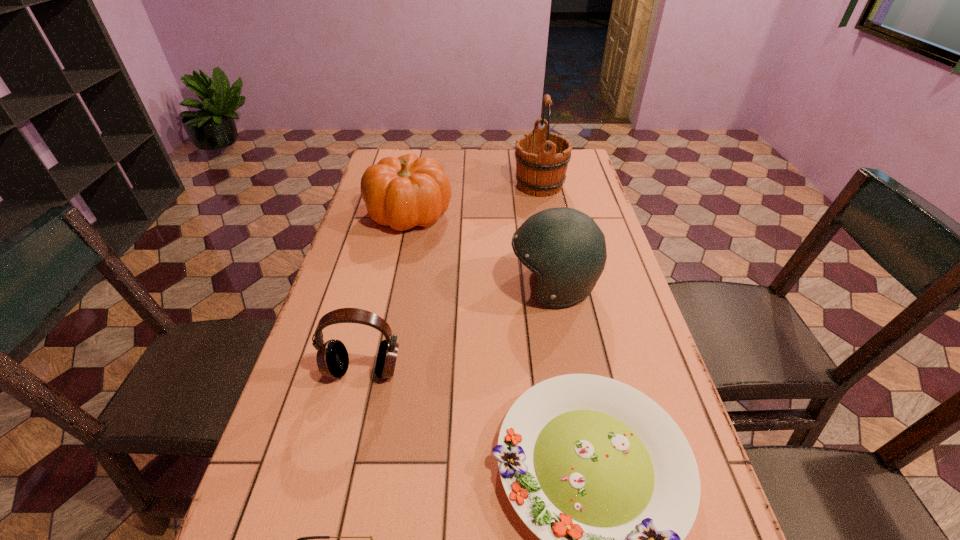
This screenshot has width=960, height=540. Identify the location of wine bucket. (542, 159).

You are a GUI agent. You are given a task and a screenshot of the screen. Output one action in this format:
    pyautogui.click(x=<x>, y=<y>)
    Task: Click on the football helmet
    This screenshot has width=960, height=540.
    Given the screenshot: What is the action you would take?
    pyautogui.click(x=566, y=249)

At what (x,y) coordinates should I click in order to perform the action: click on pumpkin. Please return your answer as a coordinate pair (x, y). The image size is (960, 540). Looking at the image, I should click on (408, 191).

Where is `headset`? Image resolution: width=960 pixels, height=540 pixels. headset is located at coordinates (332, 357).

This screenshot has width=960, height=540. I want to click on blank space located on the front of the tallest object, so click(x=549, y=237).

Locate an element on the screen. free space located 0.240m at the face opening of the third farthest object is located at coordinates (419, 286).

Where is `vacant area located 0.200m at the face opening of the third farthest object`? Image resolution: width=960 pixels, height=540 pixels. vacant area located 0.200m at the face opening of the third farthest object is located at coordinates (434, 286).

Locate an element on the screen. vacant region located 0.330m at the face opening of the third farthest object is located at coordinates (385, 286).

At what (x,y) coordinates should I click in order to perform the action: click on vacant space situated 0.120m on the right of the pumpkin. Please return your answer as a coordinate pair (x, y). Looking at the image, I should click on (490, 213).

Where is `blank space located 0.150m on the ear pads of the headset`? This screenshot has height=540, width=960. blank space located 0.150m on the ear pads of the headset is located at coordinates (344, 454).